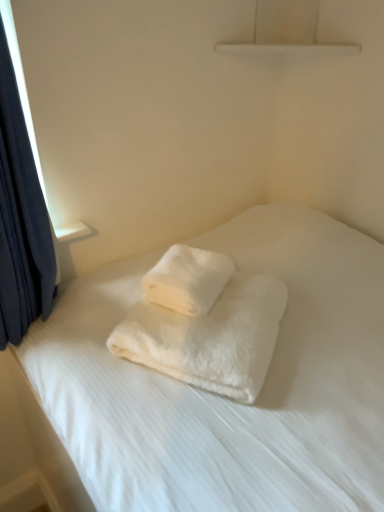
Locate an element on the screen. The width and height of the screenshot is (384, 512). empty space that is ontop of white fluffy towel at center, which is the first towel from bottom to top is located at coordinates (220, 311).